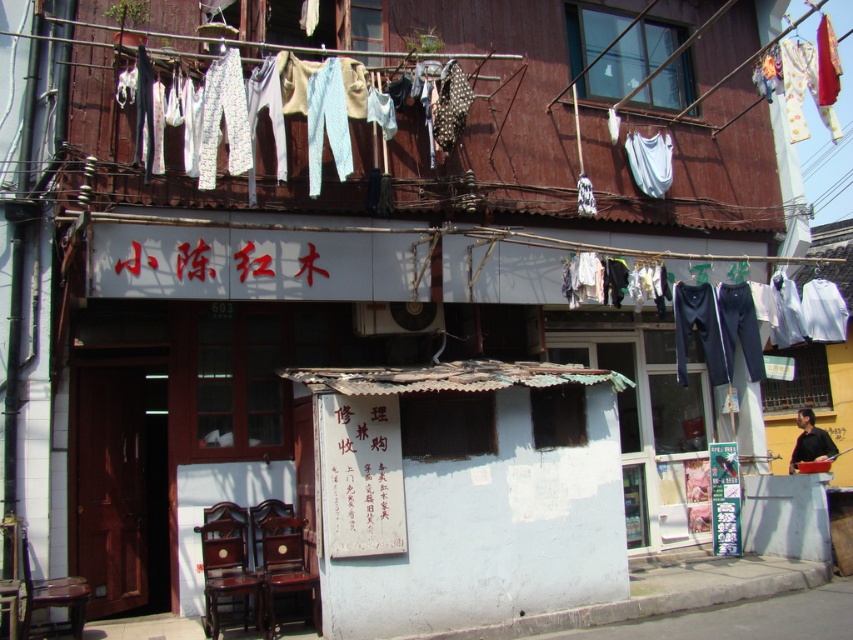
Can you confirm if mahogany wood chair at lower left is wider than mahogany wood chair at lower center?

In fact, mahogany wood chair at lower left might be narrower than mahogany wood chair at lower center.

Does mahogany wood chair at lower left have a lesser width compared to mahogany wood chair at lower center?

Yes, mahogany wood chair at lower left is thinner than mahogany wood chair at lower center.

The image size is (853, 640). I want to click on mahogany wood chair at lower left, so click(227, 566).

Who is more forward, (202, 536) or (21, 541)?

Point (21, 541)

Which is more to the right, mahogany wood chair at lower left or wooden chair at lower left?

mahogany wood chair at lower left is more to the right.

Is point (234, 573) positioned before point (41, 592)?

No, (234, 573) is further to viewer.

Identify the location of mahogany wood chair at lower left. This screenshot has height=640, width=853. (227, 566).

Between black paper sign at center and mahogany wood chair at lower center, which one has more height?

black paper sign at center is taller.

Does black paper sign at center have a lesser height compared to mahogany wood chair at lower center?

In fact, black paper sign at center may be taller than mahogany wood chair at lower center.

Locate an element on the screen. Image resolution: width=853 pixels, height=640 pixels. black paper sign at center is located at coordinates (364, 470).